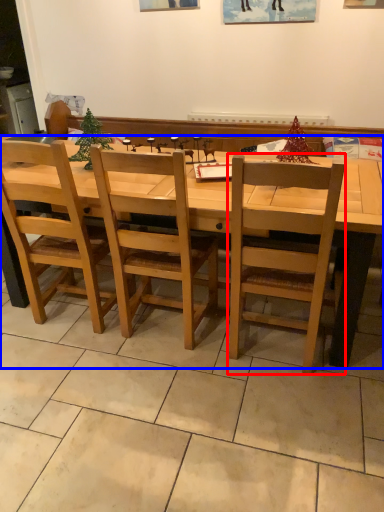
Question: Which of the following is the farthest to the observer, chair (highlighted by a red box) or desk (highlighted by a blue box)?

Choices:
 (A) chair
 (B) desk

Answer: (B)